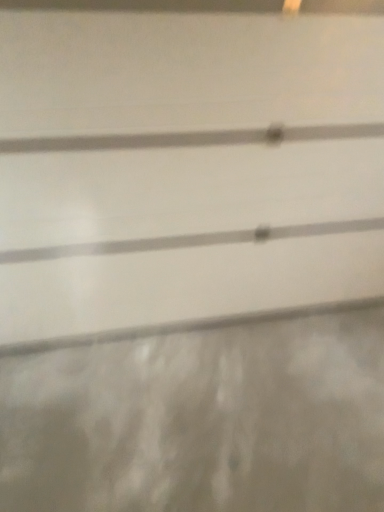
Image resolution: width=384 pixels, height=512 pixels. What do you see at coordinates (187, 232) in the screenshot?
I see `white glossy drawer at center` at bounding box center [187, 232].

Where is `white glossy drawer at center`? This screenshot has height=512, width=384. white glossy drawer at center is located at coordinates (187, 232).

You are a GUI agent. You are given a task and a screenshot of the screen. Output one action in this format:
    pyautogui.click(x=<x>, y=<y>)
    Task: Click on the white glossy drawer at center
    
    Given the screenshot: What is the action you would take?
    pyautogui.click(x=187, y=232)